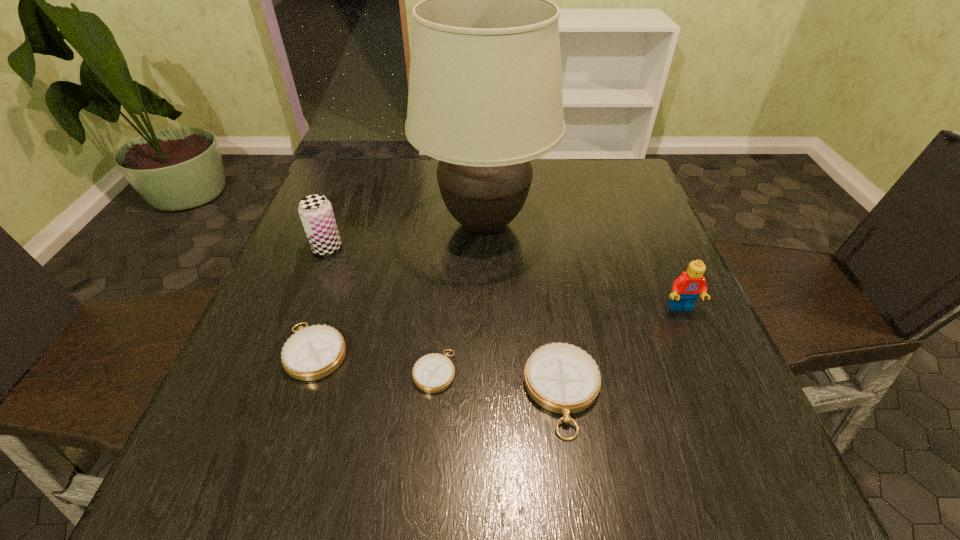
The width and height of the screenshot is (960, 540). In order to click on the second shortest object in this screenshot , I will do `click(313, 352)`.

Identify the location of the leftmost compass. (313, 352).

What are the coordinates of `the second compass from right to left` in the screenshot? It's located at (432, 373).

You are a GUI agent. You are given a task and a screenshot of the screen. Output one action in this format:
    pyautogui.click(x=<x>, y=<y>)
    Task: Click on the shortest compass
    The width and height of the screenshot is (960, 540).
    Given the screenshot: What is the action you would take?
    pyautogui.click(x=432, y=373)

Identify the location of the rightmost compass. Image resolution: width=960 pixels, height=540 pixels. (560, 377).

This screenshot has width=960, height=540. In order to click on beer can in this screenshot , I will do tap(315, 211).

Where is `the rightmost object`? Image resolution: width=960 pixels, height=540 pixels. the rightmost object is located at coordinates (686, 288).

The height and width of the screenshot is (540, 960). What are the coordinates of `Lego` in the screenshot? It's located at (686, 288).

The image size is (960, 540). I want to click on the tallest object, so click(x=485, y=98).

Where is `vacant space located 0.330m on the right of the leftmost compass`? The height and width of the screenshot is (540, 960). vacant space located 0.330m on the right of the leftmost compass is located at coordinates (524, 351).